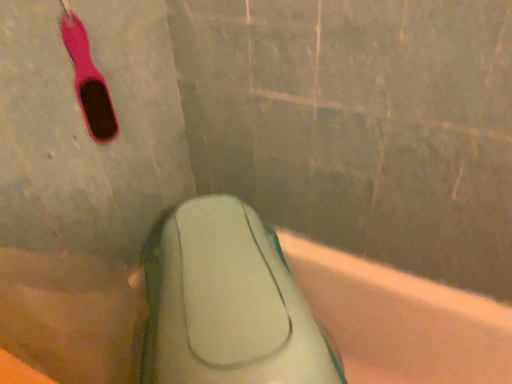
Question: Does green rubber sponge at lower center appear on the left side of pink rubber toothbrush at upper left?

Choices:
 (A) no
 (B) yes

Answer: (A)

Question: Considering the relative positions of green rubber sponge at lower center and pink rubber toothbrush at upper left in the image provided, is green rubber sponge at lower center to the right of pink rubber toothbrush at upper left from the viewer's perspective?

Choices:
 (A) no
 (B) yes

Answer: (B)

Question: Does green rubber sponge at lower center turn towards pink rubber toothbrush at upper left?

Choices:
 (A) no
 (B) yes

Answer: (A)

Question: From a real-world perspective, is green rubber sponge at lower center positioned under pink rubber toothbrush at upper left based on gravity?

Choices:
 (A) yes
 (B) no

Answer: (A)

Question: Does green rubber sponge at lower center have a greater height compared to pink rubber toothbrush at upper left?

Choices:
 (A) no
 (B) yes

Answer: (B)

Question: Is green rubber sponge at lower center smaller than pink rubber toothbrush at upper left?

Choices:
 (A) no
 (B) yes

Answer: (A)

Question: Considering the relative sizes of pink rubber toothbrush at upper left and green rubber sponge at lower center in the image provided, is pink rubber toothbrush at upper left shorter than green rubber sponge at lower center?

Choices:
 (A) yes
 (B) no

Answer: (A)

Question: Does pink rubber toothbrush at upper left have a smaller size compared to green rubber sponge at lower center?

Choices:
 (A) yes
 (B) no

Answer: (A)

Question: From the image's perspective, would you say pink rubber toothbrush at upper left is positioned over green rubber sponge at lower center?

Choices:
 (A) yes
 (B) no

Answer: (A)

Question: Considering the relative sizes of pink rubber toothbrush at upper left and green rubber sponge at lower center in the image provided, is pink rubber toothbrush at upper left wider than green rubber sponge at lower center?

Choices:
 (A) yes
 (B) no

Answer: (B)

Question: From the image's perspective, is pink rubber toothbrush at upper left beneath green rubber sponge at lower center?

Choices:
 (A) yes
 (B) no

Answer: (B)

Question: Can you confirm if pink rubber toothbrush at upper left is taller than green rubber sponge at lower center?

Choices:
 (A) yes
 (B) no

Answer: (B)

Question: In terms of width, does green rubber sponge at lower center look wider or thinner when compared to pink rubber toothbrush at upper left?

Choices:
 (A) thin
 (B) wide

Answer: (B)